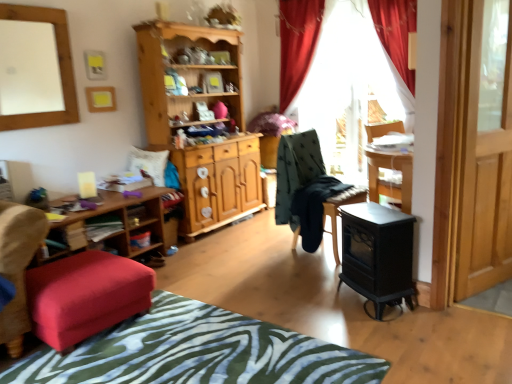
The width and height of the screenshot is (512, 384). Identify the location of free space between black matte wood stove at lower right and zebra print fabric at lower center. (x=309, y=307).